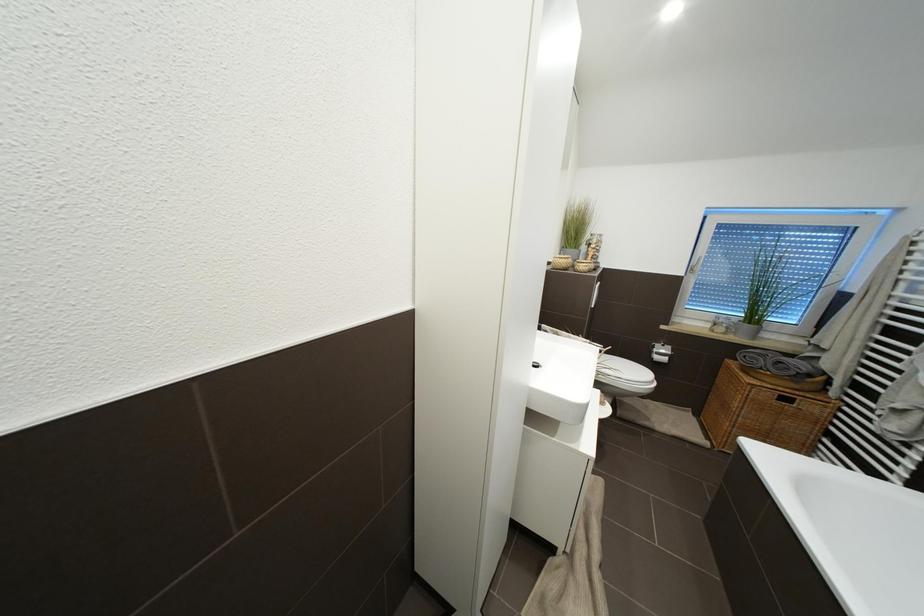
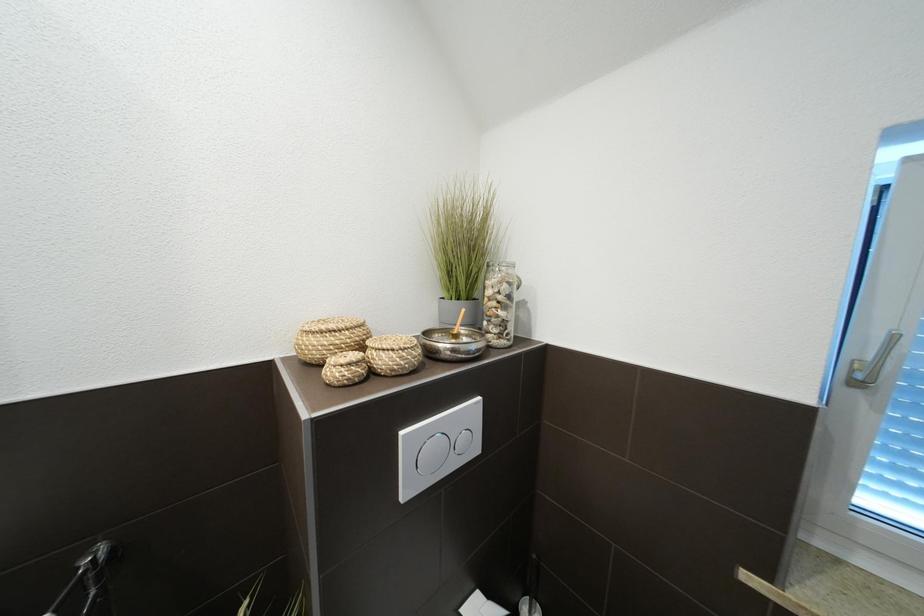
What movement of the cameraman would produce the second image?

The movement direction of the cameraman is right, forward.